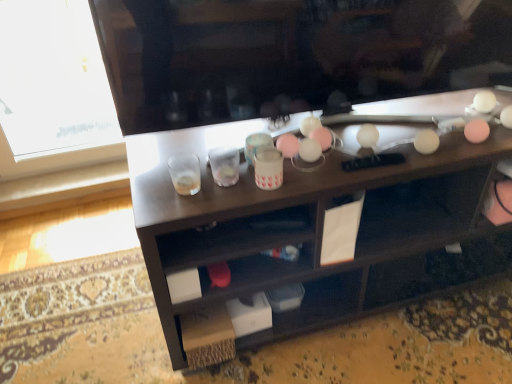
The width and height of the screenshot is (512, 384). Identify the location of free space behind translucent glass at center, which ranks as the second shot glass in right-to-left order. (184, 154).